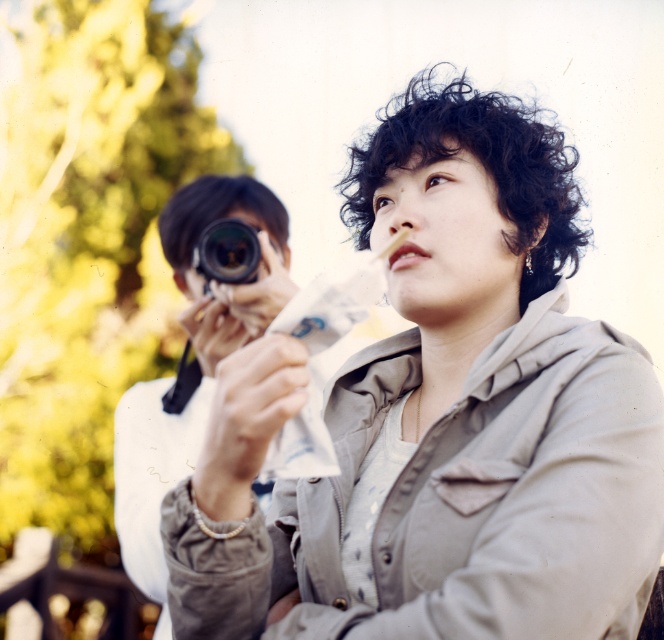
You are standing at the point with coordinates (442, 417). What object is located exactly at your current position?

The matte beige jacket at center is located exactly at the point with coordinates (442, 417).

You are a photographer trying to capture a candid shot of the person in the matte beige jacket at center. You have a black plastic camera at center. Since the camera is much shorter than the jacket, where should you position yourself to ensure the entire jacket is in the frame?

The matte beige jacket at center is much taller than the black plastic camera at center. To capture the entire jacket in the frame, position yourself lower so that you can angle the camera upwards to include the full height of the jacket.

You are taking a photo with the black plastic camera at center. To avoid blocking the view of the matte beige jacket at center in your photo, where should you position the camera relative to the jacket?

The matte beige jacket at center is positioned under the black plastic camera at center, so to avoid blocking the view of the matte beige jacket at center, you should position the camera above the jacket.